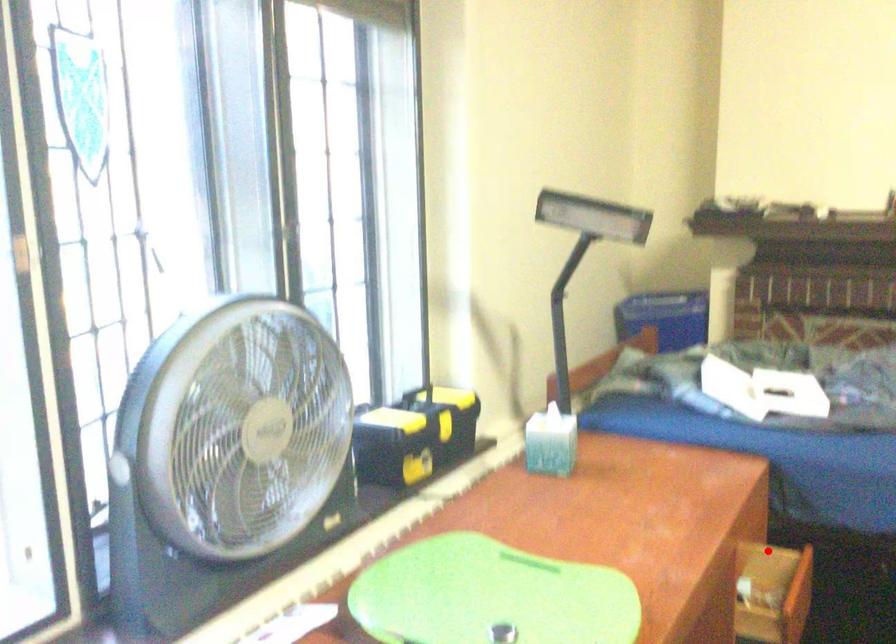
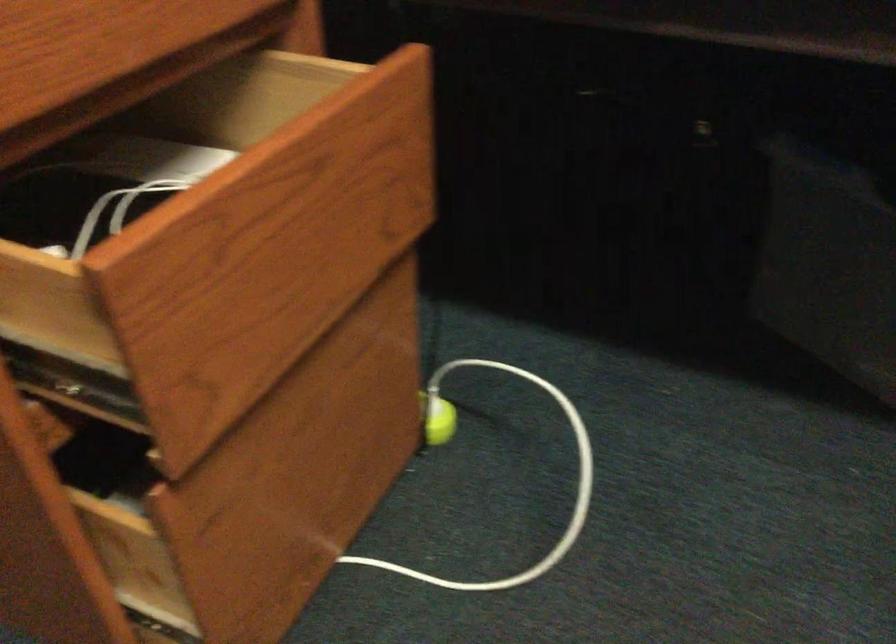
Question: I am providing you with two images of the same scene from different viewpoints. A red point is shown in image1. For the corresponding object point in image2, is it positioned nearer or farther from the camera?

Choices:
 (A) Nearer
 (B) Farther

Answer: (A)